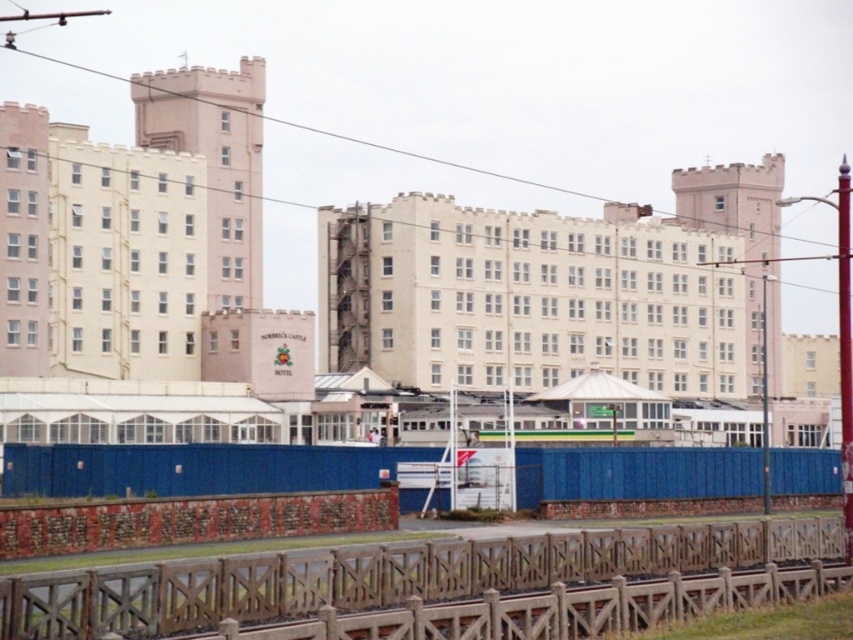
Is wooden at lower center behind blue plastic fence at lower center?

No, wooden at lower center is closer to the viewer.

Between wooden at lower center and blue plastic fence at lower center, which one is positioned lower?

wooden at lower center is lower down.

Is point (669, 545) less distant than point (141, 456)?

Yes, point (669, 545) is closer to viewer.

Where is `wooden at lower center`? wooden at lower center is located at coordinates (383, 576).